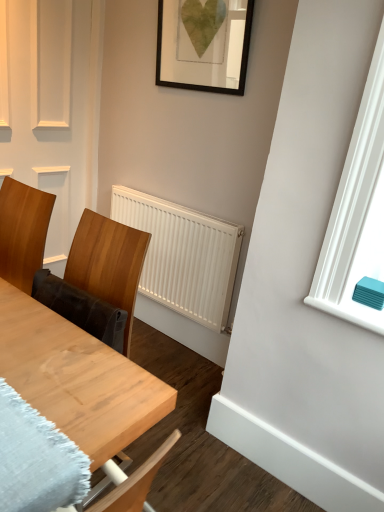
Question: Is wooden chair at left oriented away from wooden table at center?

Choices:
 (A) no
 (B) yes

Answer: (A)

Question: From a real-world perspective, is wooden chair at left under wooden table at center?

Choices:
 (A) no
 (B) yes

Answer: (A)

Question: Does wooden chair at left have a greater height compared to wooden table at center?

Choices:
 (A) no
 (B) yes

Answer: (A)

Question: From the image's perspective, is wooden chair at left on wooden table at center?

Choices:
 (A) yes
 (B) no

Answer: (A)

Question: Does wooden chair at left appear on the right side of wooden table at center?

Choices:
 (A) yes
 (B) no

Answer: (B)

Question: From the image's perspective, is wooden chair at left located above or below wooden table at center?

Choices:
 (A) below
 (B) above

Answer: (B)

Question: Is wooden chair at left bigger or smaller than wooden table at center?

Choices:
 (A) small
 (B) big

Answer: (A)

Question: Considering the positions of point (0, 241) and point (59, 375), is point (0, 241) closer or farther from the camera than point (59, 375)?

Choices:
 (A) farther
 (B) closer

Answer: (A)

Question: Considering their positions, is wooden chair at left located in front of or behind wooden table at center?

Choices:
 (A) behind
 (B) front

Answer: (A)

Question: Relative to wooden table at center, is white matte radiator at center in front or behind?

Choices:
 (A) behind
 (B) front

Answer: (A)

Question: Looking at their shapes, would you say white matte radiator at center is wider or thinner than wooden table at center?

Choices:
 (A) wide
 (B) thin

Answer: (B)

Question: Is white matte radiator at center taller or shorter than wooden table at center?

Choices:
 (A) tall
 (B) short

Answer: (A)

Question: Considering the positions of white matte radiator at center and wooden table at center in the image, is white matte radiator at center bigger or smaller than wooden table at center?

Choices:
 (A) small
 (B) big

Answer: (A)

Question: From a real-world perspective, relative to wooden chair at left, is white matte radiator at center vertically above or below?

Choices:
 (A) below
 (B) above

Answer: (A)

Question: Considering the positions of white matte radiator at center and wooden chair at left in the image, is white matte radiator at center bigger or smaller than wooden chair at left?

Choices:
 (A) small
 (B) big

Answer: (A)